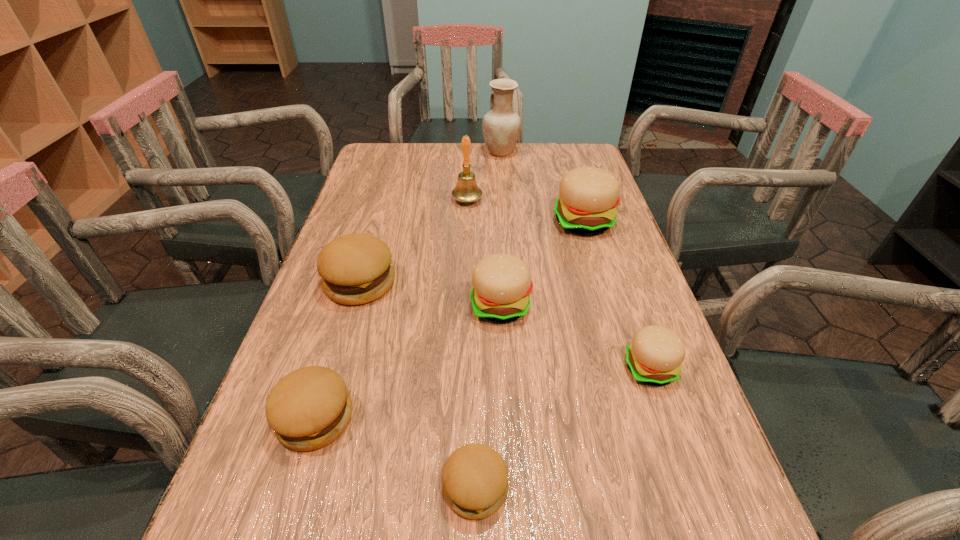
This screenshot has height=540, width=960. I want to click on object present at the far edge, so click(501, 126).

Locate an element on the screen. vacant position at the far edge of the desktop is located at coordinates [470, 166].

Find the location of a particular element. free space at the left edge of the desktop is located at coordinates tap(405, 193).

Locate an element on the screen. This screenshot has width=960, height=540. vacant area at the right edge of the desktop is located at coordinates (613, 319).

Image resolution: width=960 pixels, height=540 pixels. I want to click on free space at the far left corner of the desktop, so click(401, 160).

Locate an element on the screen. This screenshot has height=540, width=960. vacant space at the far right corner of the desktop is located at coordinates (561, 146).

This screenshot has height=540, width=960. Find the location of `vacant area that lies between the rightmost brown hamburger and the leftmost beige hamburger`. vacant area that lies between the rightmost brown hamburger and the leftmost beige hamburger is located at coordinates (489, 396).

The height and width of the screenshot is (540, 960). Find the location of `empty space between the biggest beige hamburger and the farthest object`. empty space between the biggest beige hamburger and the farthest object is located at coordinates pos(542,187).

Where is `free space between the nearest beige hamburger and the second biggest brown hamburger`? The width and height of the screenshot is (960, 540). free space between the nearest beige hamburger and the second biggest brown hamburger is located at coordinates (483, 393).

This screenshot has height=540, width=960. I want to click on free spot between the bell and the smallest beige hamburger, so click(559, 284).